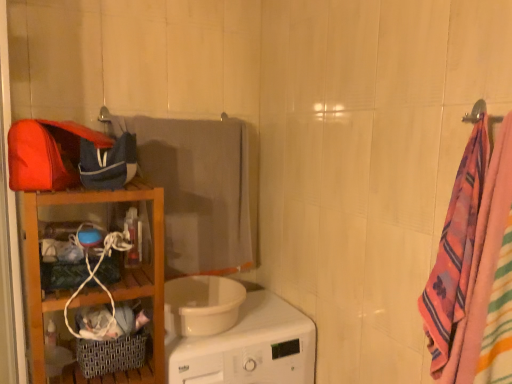
Where is `white glossy washing machine at center`? The height and width of the screenshot is (384, 512). white glossy washing machine at center is located at coordinates (249, 347).

How much space does multicolored woven towel at right, placed as the 2th beach towel when sorted from left to right, occupy vertically?

The height of multicolored woven towel at right, placed as the 2th beach towel when sorted from left to right, is 28.54 inches.

Describe the element at coordinates (455, 250) in the screenshot. I see `multicolored woven towel at right, placed as the 2th beach towel when sorted from left to right` at that location.

Locate an element on the screen. The image size is (512, 384). wooden shelf at left is located at coordinates (106, 285).

Would you say white glossy washing machine at center is a long distance from wooden shelf at left?

Actually, white glossy washing machine at center and wooden shelf at left are a little close together.

Which of these two, white glossy washing machine at center or wooden shelf at left, is smaller?

With smaller size is wooden shelf at left.

Is white glossy washing machine at center oriented towards wooden shelf at left?

No, white glossy washing machine at center is not turned towards wooden shelf at left.

Is multicolored woven towel at right, which is the first beach towel from right to left, smaller than wooden shelf at left?

Indeed, multicolored woven towel at right, which is the first beach towel from right to left, has a smaller size compared to wooden shelf at left.

Image resolution: width=512 pixels, height=384 pixels. I want to click on furniture beneath the multicolored woven towel at right, placed as the 2th beach towel when sorted from left to right (from a real-world perspective), so click(106, 285).

Which is nearer, [466,120] or [36,257]?

Point [466,120]

From a real-world perspective, is white glossy washing machine at center under gray fabric towel at center, which is the 1th beach towel in left-to-right order?

Indeed, from a real-world perspective, white glossy washing machine at center is positioned beneath gray fabric towel at center, which is the 1th beach towel in left-to-right order.

Can you tell me how much white glossy washing machine at center and gray fabric towel at center, the second beach towel from the front, differ in facing direction?

white glossy washing machine at center and gray fabric towel at center, the second beach towel from the front, are facing 0.000191 degrees away from each other.

Is white glossy washing machine at center aimed at gray fabric towel at center, the second beach towel from the front?

No, white glossy washing machine at center is not facing towards gray fabric towel at center, the second beach towel from the front.

Considering the positions of objects gray fabric towel at center, the second beach towel from the front, and multicolored woven towel at right, the 1th beach towel from the front, in the image provided, who is more to the left, gray fabric towel at center, the second beach towel from the front, or multicolored woven towel at right, the 1th beach towel from the front,?

gray fabric towel at center, the second beach towel from the front, is more to the left.

Which is further, (200,168) or (448,242)?

The point (200,168) is behind.

The image size is (512, 384). I want to click on beach towel on the left of multicolored woven towel at right, placed as the 2th beach towel when sorted from left to right, so click(196, 189).

From a real-world perspective, is gray fabric towel at center, acting as the first beach towel starting from the back, on top of multicolored woven towel at right, which is the first beach towel from right to left?

No, from a real-world perspective, gray fabric towel at center, acting as the first beach towel starting from the back, is not on top of multicolored woven towel at right, which is the first beach towel from right to left.

In the scene shown: Is wooden shelf at left wider or thinner than multicolored woven towel at right, which is counted as the second beach towel, starting from the back?

Considering their sizes, wooden shelf at left looks broader than multicolored woven towel at right, which is counted as the second beach towel, starting from the back.

From a real-world perspective, is wooden shelf at left on top of multicolored woven towel at right, which is counted as the second beach towel, starting from the back?

Actually, wooden shelf at left is physically below multicolored woven towel at right, which is counted as the second beach towel, starting from the back, in the real world.

Is point (153, 248) closer or farther from the camera than point (441, 300)?

Point (153, 248).

Which is in front, wooden shelf at left or multicolored woven towel at right, placed as the 2th beach towel when sorted from left to right?

multicolored woven towel at right, placed as the 2th beach towel when sorted from left to right.

Are wooden shelf at left and gray fabric towel at center, the second beach towel from the front, far apart?

wooden shelf at left is actually quite close to gray fabric towel at center, the second beach towel from the front.

Identify the location of furniture below the gray fabric towel at center, the second beach towel from the front (from the image's perspective). (106, 285).

Is wooden shelf at left further to the viewer compared to gray fabric towel at center, the second beach towel from the front?

No.

From the image's perspective, who appears lower, wooden shelf at left or gray fabric towel at center, acting as the first beach towel starting from the back?

wooden shelf at left appears lower in the image.

In the scene shown: Would you say multicolored woven towel at right, placed as the 2th beach towel when sorted from left to right, is outside gray fabric towel at center, the second beach towel from the front?

Absolutely, multicolored woven towel at right, placed as the 2th beach towel when sorted from left to right, is external to gray fabric towel at center, the second beach towel from the front.

The image size is (512, 384). Identify the location of beach towel behind the multicolored woven towel at right, the 1th beach towel from the front. (196, 189).

From the image's perspective, is multicolored woven towel at right, the 1th beach towel from the front, beneath gray fabric towel at center, acting as the first beach towel starting from the back?

Yes, from the image's perspective, multicolored woven towel at right, the 1th beach towel from the front, is beneath gray fabric towel at center, acting as the first beach towel starting from the back.

Image resolution: width=512 pixels, height=384 pixels. Find the location of `home appliance that appears below the wooden shelf at left (from a real-world perspective)`. home appliance that appears below the wooden shelf at left (from a real-world perspective) is located at coordinates (249, 347).

You are a GUI agent. You are given a task and a screenshot of the screen. Output one action in this format:
    pyautogui.click(x=<x>, y=<y>)
    Task: Click on the furniture below the multicolored woven towel at right, placed as the 2th beach towel when sorted from left to right (from the image's perspective)
    The height and width of the screenshot is (384, 512).
    Given the screenshot: What is the action you would take?
    pyautogui.click(x=106, y=285)

Based on their spatial positions, is white glossy washing machine at center or gray fabric towel at center, the second beach towel from the right, further from wooden shelf at left?

gray fabric towel at center, the second beach towel from the right, is further to wooden shelf at left.

From the image, which object appears to be nearer to wooden shelf at left, multicolored woven towel at right, placed as the 2th beach towel when sorted from left to right, or gray fabric towel at center, the second beach towel from the right?

gray fabric towel at center, the second beach towel from the right.

Looking at the image, which one is located closer to multicolored woven towel at right, which is counted as the second beach towel, starting from the back, gray fabric towel at center, the second beach towel from the front, or wooden shelf at left?

Among the two, wooden shelf at left is located nearer to multicolored woven towel at right, which is counted as the second beach towel, starting from the back.

From the image, which object appears to be nearer to multicolored woven towel at right, the 1th beach towel from the front, white glossy washing machine at center or gray fabric towel at center, which is the 1th beach towel in left-to-right order?

Based on the image, white glossy washing machine at center appears to be nearer to multicolored woven towel at right, the 1th beach towel from the front.

When comparing their distances from white glossy washing machine at center, does multicolored woven towel at right, which is the first beach towel from right to left, or wooden shelf at left seem further?

The object further to white glossy washing machine at center is multicolored woven towel at right, which is the first beach towel from right to left.

Considering their positions, is multicolored woven towel at right, which is counted as the second beach towel, starting from the back, positioned further to white glossy washing machine at center than gray fabric towel at center, the second beach towel from the front?

multicolored woven towel at right, which is counted as the second beach towel, starting from the back, lies further to white glossy washing machine at center than the other object.

In the scene shown: Which object lies nearer to the anchor point gray fabric towel at center, the second beach towel from the right, white glossy washing machine at center or wooden shelf at left?

wooden shelf at left.

Looking at the image, which one is located further to wooden shelf at left, multicolored woven towel at right, the 1th beach towel from the front, or white glossy washing machine at center?

multicolored woven towel at right, the 1th beach towel from the front.

The image size is (512, 384). Find the location of `furniture between gray fabric towel at center, the second beach towel from the right, and white glossy washing machine at center from top to bottom`. furniture between gray fabric towel at center, the second beach towel from the right, and white glossy washing machine at center from top to bottom is located at coordinates (106, 285).

Find the location of a particular element. Image resolution: width=512 pixels, height=384 pixels. beach towel between wooden shelf at left and multicolored woven towel at right, the 1th beach towel from the front, from left to right is located at coordinates (196, 189).

Image resolution: width=512 pixels, height=384 pixels. What are the coordinates of `home appliance located between wooden shelf at left and multicolored woven towel at right, the 1th beach towel from the front, in the left-right direction` in the screenshot? It's located at (249, 347).

Identify the location of home appliance between gray fabric towel at center, the second beach towel from the right, and multicolored woven towel at right, the 1th beach towel from the front, in the horizontal direction. This screenshot has width=512, height=384. (249, 347).